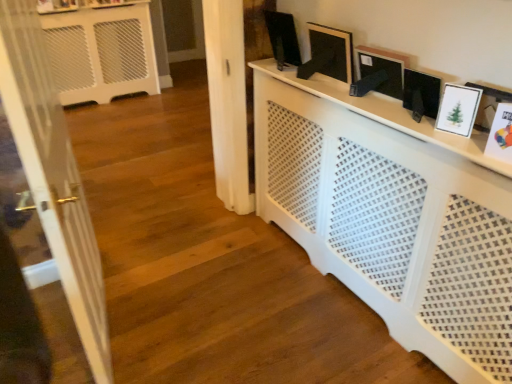
Where is `vacant area that is in front of white glossy picture frame at upper right, which is the fourth picture frame in back-to-front order`? vacant area that is in front of white glossy picture frame at upper right, which is the fourth picture frame in back-to-front order is located at coordinates (468, 141).